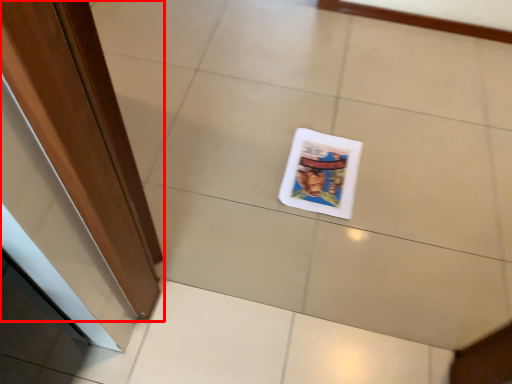
Question: Observing the image, what is the correct spatial positioning of door (annotated by the red box) in reference to magazine?

Choices:
 (A) left
 (B) right

Answer: (A)